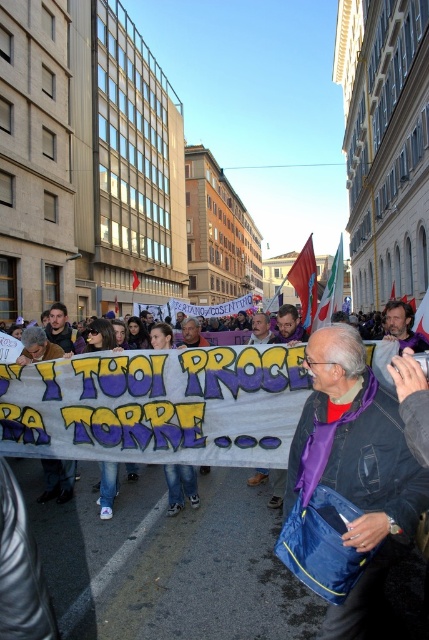
You are a photographer trying to capture the protest scene. You notice the purple fabric bag at center and the white fabric flag at center. Which object is positioned to the left of the other?

The purple fabric bag at center is to the left of the white fabric flag at center.

You are a photographer standing at the edge of the protest crowd. You want to take a photo that includes both the purple fabric bag at center and the red fabric flag at center. If your camera has a maximum focus range of 4 meters, will both objects be in focus?

The distance between the purple fabric bag at center and the red fabric flag at center is 3.93 meters, which is within the camera maximum focus range of 4 meters. Therefore, both objects will be in focus.